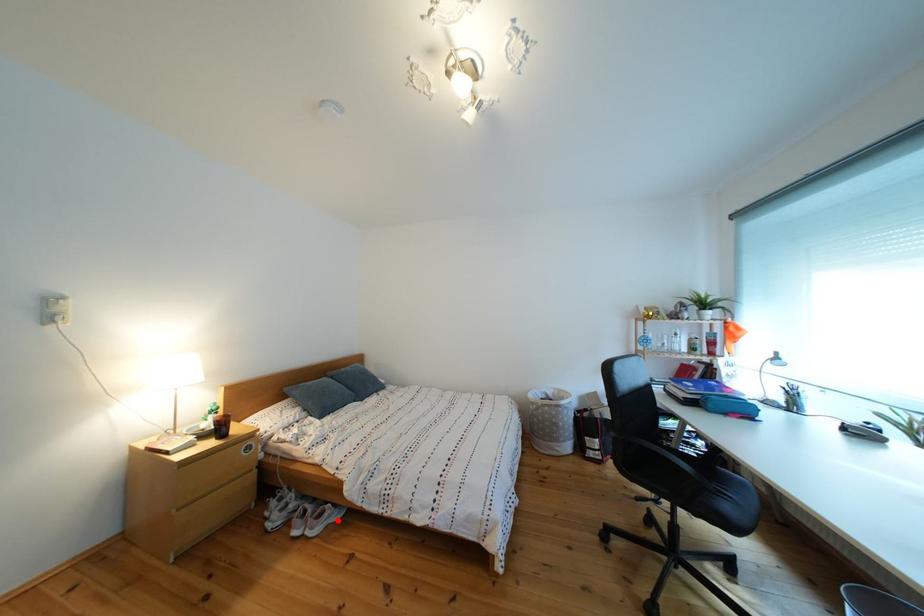
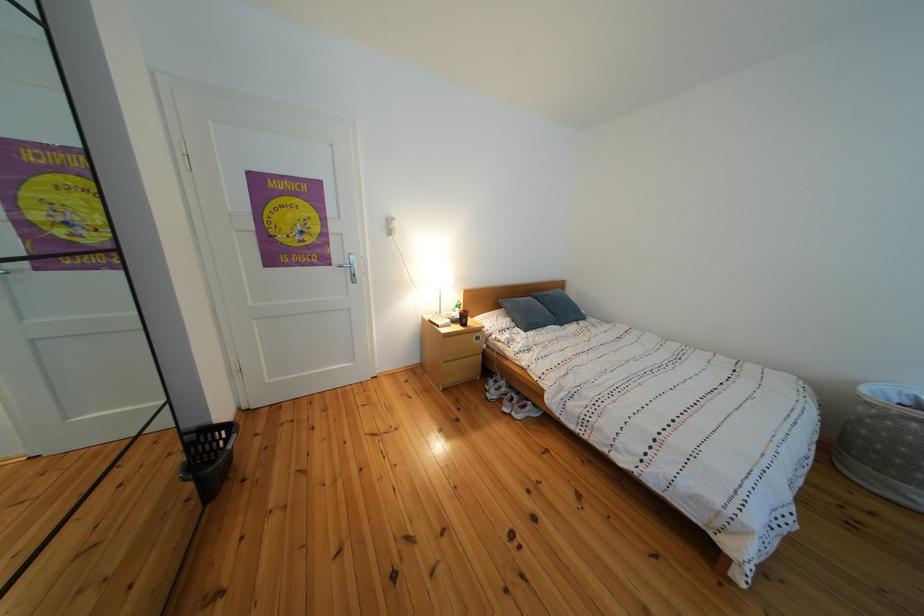
Question: I am providing you with two images of the same scene from different viewpoints. A red point is shown in image1. For the corresponding object point in image2, is it positioned nearer or farther from the camera?

Choices:
 (A) Nearer
 (B) Farther

Answer: (A)